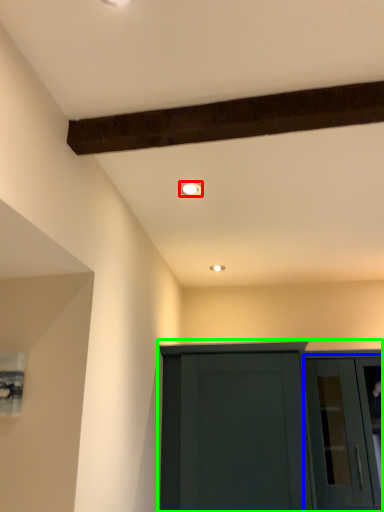
Question: Based on their relative distances, which object is farther from lighting (highlighted by a red box)? Choose from glass door (highlighted by a blue box) and cupboard (highlighted by a green box).

Choices:
 (A) glass door
 (B) cupboard

Answer: (A)